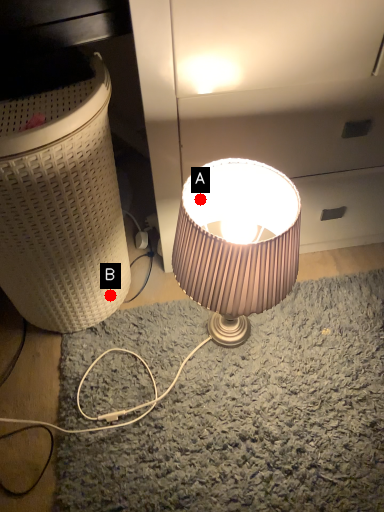
Question: Two points are circled on the image, labeled by A and B beside each circle. Which point is closer to the camera taking this photo?

Choices:
 (A) A is closer
 (B) B is closer

Answer: (A)